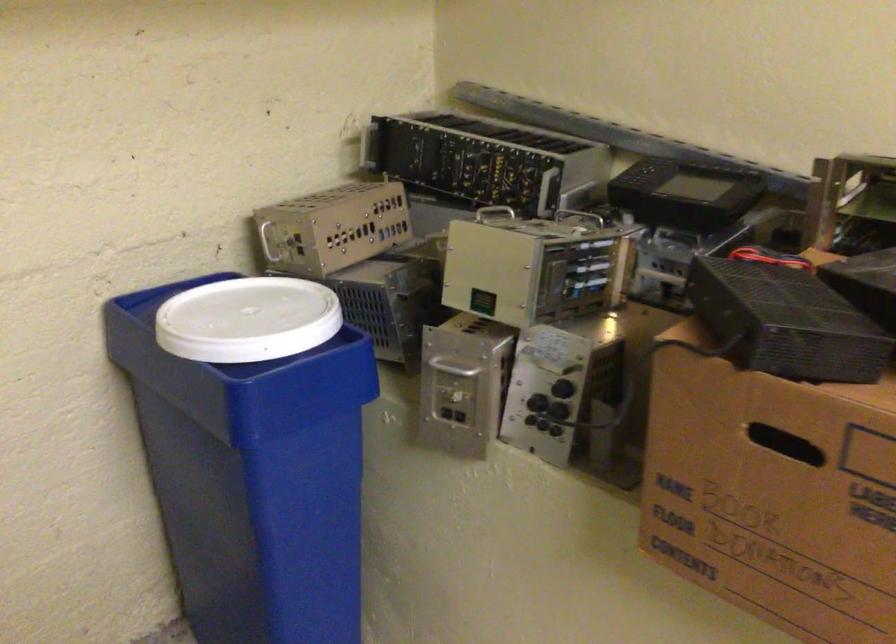
Find the location of a particular element. The image size is (896, 644). white plastic lid is located at coordinates (247, 319).